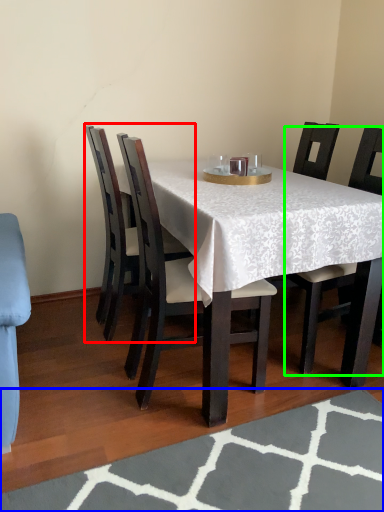
Question: Based on their relative distances, which object is nearer to chair (highlighted by a red box)? Choose from place mat (highlighted by a blue box) and chair (highlighted by a green box).

Choices:
 (A) place mat
 (B) chair

Answer: (B)